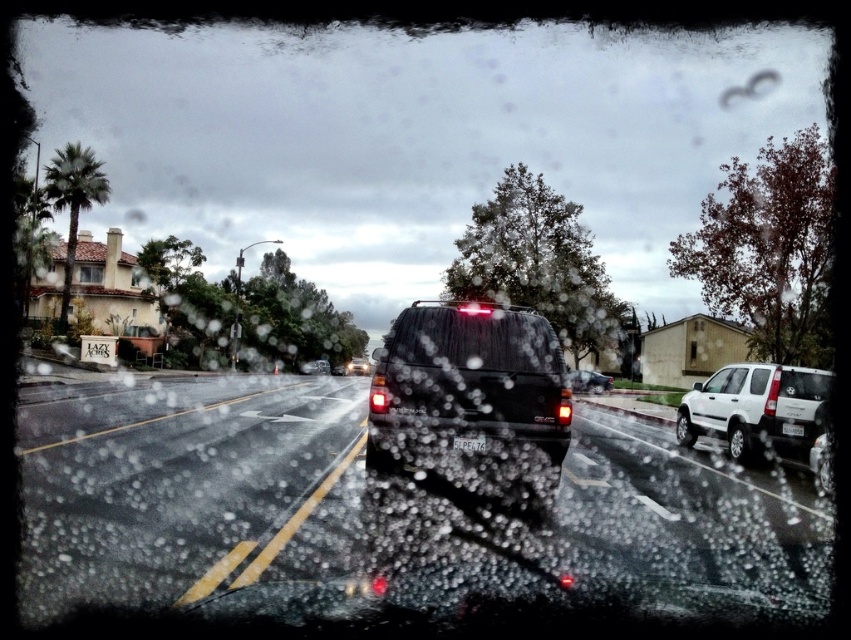
Is transparent glass windshield at center wider than metallic silver suv at center?

In fact, transparent glass windshield at center might be narrower than metallic silver suv at center.

Is transparent glass windshield at center to the left of metallic silver suv at center from the viewer's perspective?

Yes, transparent glass windshield at center is to the left of metallic silver suv at center.

Which is behind, point (404, 324) or point (604, 376)?

The point (604, 376) is behind.

Find the location of a particular element. The height and width of the screenshot is (640, 851). transparent glass windshield at center is located at coordinates (473, 339).

Does shiny black suv at center lie behind white plastic license plate at center?

Yes, it is.

At what (x,y) coordinates should I click in order to perform the action: click on shiny black suv at center. Please return your answer as a coordinate pair (x, y). Looking at the image, I should click on (358, 365).

Find the location of a particular element. The image size is (851, 640). shiny black suv at center is located at coordinates (358, 365).

Does metallic silver suv at center have a lesser height compared to white plastic license plate at center?

Incorrect, metallic silver suv at center's height does not fall short of white plastic license plate at center's.

Where is `metallic silver suv at center`? The width and height of the screenshot is (851, 640). metallic silver suv at center is located at coordinates (589, 380).

Between point (595, 381) and point (794, 422), which one is positioned in front?

Positioned in front is point (794, 422).

You are a GUI agent. You are given a task and a screenshot of the screen. Output one action in this format:
    pyautogui.click(x=<x>, y=<y>)
    Task: Click on the metallic silver suv at center
    
    Given the screenshot: What is the action you would take?
    pyautogui.click(x=589, y=380)